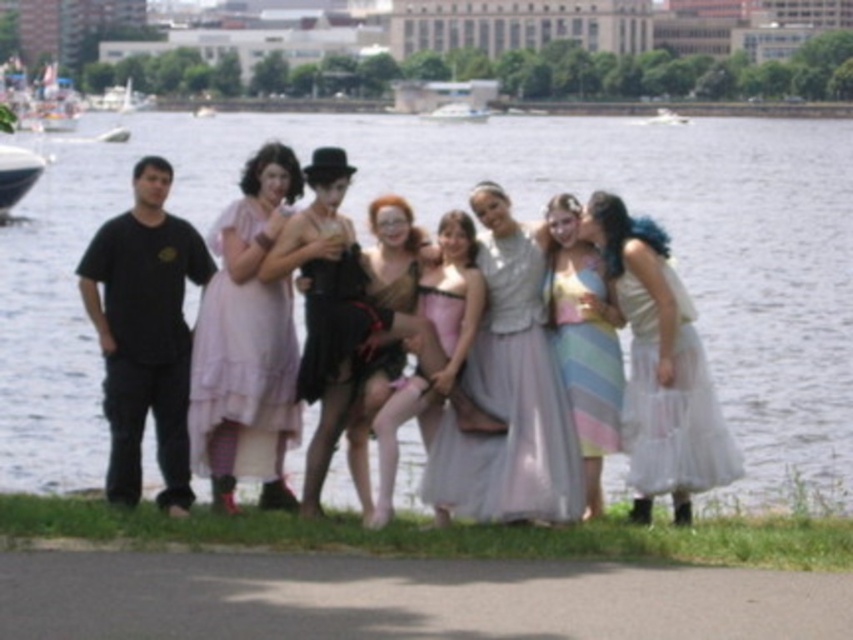
Question: Is white lace dress at right bigger than pastel striped dress at center?

Choices:
 (A) yes
 (B) no

Answer: (A)

Question: Considering the real-world distances, which object is farthest from the pastel satin dress at center?

Choices:
 (A) clear water at center
 (B) white lace dress at right
 (C) matte gold dress at center

Answer: (A)

Question: Which object is closer to the camera taking this photo?

Choices:
 (A) white plastic boat at center
 (B) pastel striped dress at center
 (C) white plastic boat at left
 (D) pastel satin dress at center

Answer: (D)

Question: Among these points, which one is nearest to the camera?

Choices:
 (A) (463, 116)
 (B) (527, 504)

Answer: (B)

Question: Is pastel satin dress at center to the left of white plastic boat at left from the viewer's perspective?

Choices:
 (A) no
 (B) yes

Answer: (A)

Question: Can you confirm if pink chiffon dress at center is thinner than pastel striped dress at center?

Choices:
 (A) yes
 (B) no

Answer: (B)